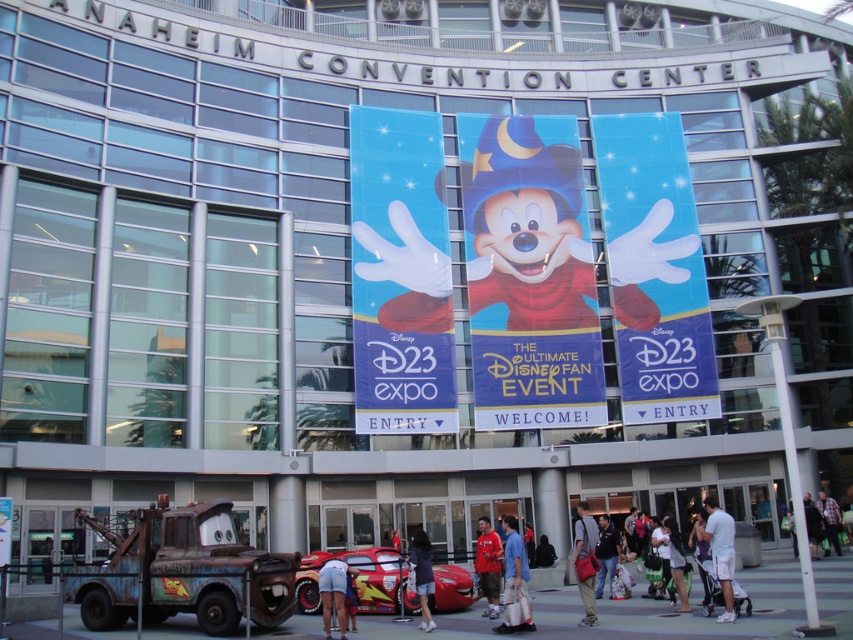
You are a visitor at the Anaheim Convention Center for the D23 Expo. You see the matte wizard hat at center and the matte black backpack at center. If you want to walk from the entrance to the character, which object should you aim for first?

Both the matte wizard hat at center and the matte black backpack at center are located at the center, so you should aim for either one as they are both part of the character setup.

You are standing at the entrance of the Anaheim Convention Center and see the blue glossy banner at center and the shiny red car at center. You want to take a photo of both objects in the same frame. Considering the distance between them, will you be able to capture both in a single photo without moving your camera position?

The blue glossy banner at center is 66.86 feet away from the shiny red car at center. Since the distance between them is significant, you would need a wide angle lens to capture both in the same frame without moving your camera position.

Based on the photo, you are a photographer at the Anaheim Convention Center. You need to capture a photo that includes both the white glossy hand at upper center and the dark blue jacket at center. Considering their sizes, which object should you focus on to ensure both fit in the frame?

The white glossy hand at upper center is wider than the dark blue jacket at center. To ensure both fit in the frame, focus on the white glossy hand at upper center as it is the wider object, allowing the dark blue jacket at center to fit alongside within the camera frame.